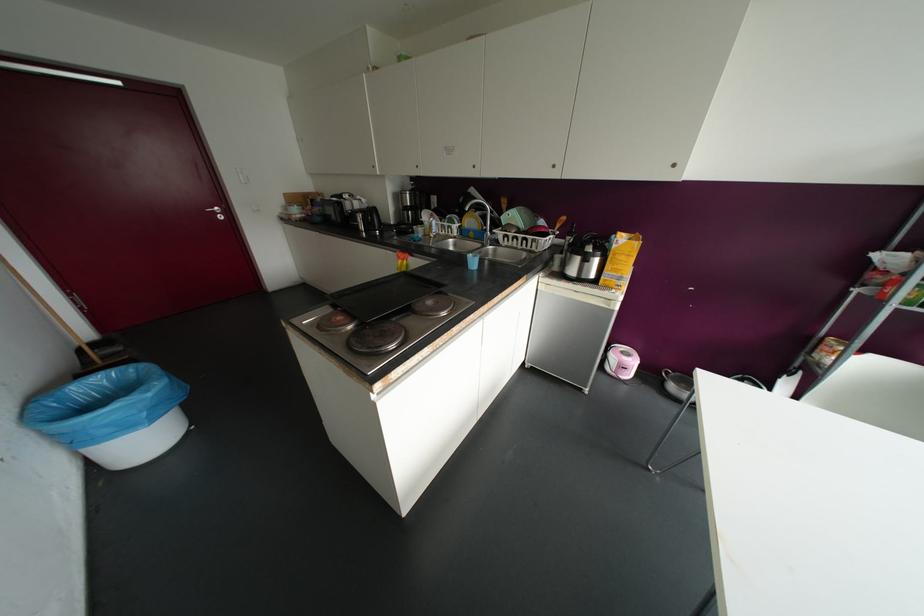
Describe the element at coordinates (383, 294) in the screenshot. Image resolution: width=924 pixels, height=616 pixels. I see `the black baking tray` at that location.